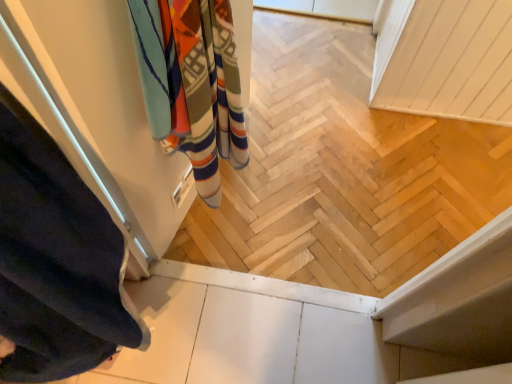
Identify the location of dark blue fabric at left. This screenshot has height=384, width=512. (56, 261).

What do you see at coordinates (56, 261) in the screenshot? The width and height of the screenshot is (512, 384). I see `dark blue fabric at left` at bounding box center [56, 261].

Describe the element at coordinates (192, 84) in the screenshot. I see `multicolored woven towel at upper left` at that location.

In order to face multicolored woven towel at upper left, should I rotate leftwards or rightwards?

To face it directly, rotate left by 5.054 degrees.

Where is `multicolored woven towel at upper left`? multicolored woven towel at upper left is located at coordinates (192, 84).

The width and height of the screenshot is (512, 384). Identify the location of dark blue fabric at left. point(56,261).

In the image, is multicolored woven towel at upper left on the left side or the right side of dark blue fabric at left?

In the image, multicolored woven towel at upper left appears on the right side of dark blue fabric at left.

Which object is closer to the camera taking this photo, multicolored woven towel at upper left or dark blue fabric at left?

Positioned in front is dark blue fabric at left.

Is point (151, 71) closer to viewer compared to point (29, 228)?

That is False.

From the image's perspective, which object appears higher, multicolored woven towel at upper left or dark blue fabric at left?

multicolored woven towel at upper left appears higher in the image.

From a real-world perspective, between multicolored woven towel at upper left and dark blue fabric at left, who is vertically higher?

dark blue fabric at left is physically above.

Considering the relative sizes of multicolored woven towel at upper left and dark blue fabric at left in the image provided, is multicolored woven towel at upper left wider than dark blue fabric at left?

In fact, multicolored woven towel at upper left might be narrower than dark blue fabric at left.

Is multicolored woven towel at upper left taller than dark blue fabric at left?

No, multicolored woven towel at upper left is not taller than dark blue fabric at left.

Between multicolored woven towel at upper left and dark blue fabric at left, which one has larger size?

multicolored woven towel at upper left is bigger.

Is multicolored woven towel at upper left located outside dark blue fabric at left?

multicolored woven towel at upper left is positioned outside dark blue fabric at left.

Are multicolored woven towel at upper left and dark blue fabric at left beside each other?

No, multicolored woven towel at upper left is not next to dark blue fabric at left.

Is multicolored woven towel at upper left facing away from dark blue fabric at left?

multicolored woven towel at upper left does not have its back to dark blue fabric at left.

From the picture: How many degrees apart are the facing directions of multicolored woven towel at upper left and dark blue fabric at left?

76 degrees separate the facing orientations of multicolored woven towel at upper left and dark blue fabric at left.

In the scene shown: Measure the distance from multicolored woven towel at upper left to dark blue fabric at left.

→ multicolored woven towel at upper left is 12.15 inches from dark blue fabric at left.

Where is `bath towel located underneath the dark blue fabric at left (from a real-world perspective)`? bath towel located underneath the dark blue fabric at left (from a real-world perspective) is located at coordinates (192, 84).

Is dark blue fabric at left to the left of multicolored woven towel at upper left from the viewer's perspective?

Correct, you'll find dark blue fabric at left to the left of multicolored woven towel at upper left.

Between dark blue fabric at left and multicolored woven towel at upper left, which one is positioned in front?

dark blue fabric at left.

Does point (123, 332) lie behind point (178, 132)?

No, it is not.

From the image's perspective, relative to multicolored woven towel at upper left, is dark blue fabric at left above or below?

Clearly, from the image's perspective, dark blue fabric at left is below multicolored woven towel at upper left.

From a real-world perspective, is dark blue fabric at left positioned above or below multicolored woven towel at upper left?

In terms of real-world spatial position, dark blue fabric at left is above multicolored woven towel at upper left.

Is dark blue fabric at left wider or thinner than multicolored woven towel at upper left?

Considering their sizes, dark blue fabric at left looks broader than multicolored woven towel at upper left.

Considering the sizes of objects dark blue fabric at left and multicolored woven towel at upper left in the image provided, who is shorter, dark blue fabric at left or multicolored woven towel at upper left?

multicolored woven towel at upper left.

Who is bigger, dark blue fabric at left or multicolored woven towel at upper left?

Bigger between the two is multicolored woven towel at upper left.

Is dark blue fabric at left located outside multicolored woven towel at upper left?

Yes, dark blue fabric at left is outside of multicolored woven towel at upper left.

Are dark blue fabric at left and multicolored woven towel at upper left making contact?

dark blue fabric at left and multicolored woven towel at upper left are not in contact.

Is multicolored woven towel at upper left at the back of dark blue fabric at left?

No, dark blue fabric at left is not facing the opposite direction of multicolored woven towel at upper left.

Find the location of a particular element. Image resolution: width=512 pixels, height=384 pixels. curtain on the left of multicolored woven towel at upper left is located at coordinates (56, 261).

At what (x,y) coordinates should I click in order to perform the action: click on curtain in front of the multicolored woven towel at upper left. Please return your answer as a coordinate pair (x, y). Looking at the image, I should click on (56, 261).

Where is `bath towel directly beneath the dark blue fabric at left (from a real-world perspective)`? bath towel directly beneath the dark blue fabric at left (from a real-world perspective) is located at coordinates click(192, 84).